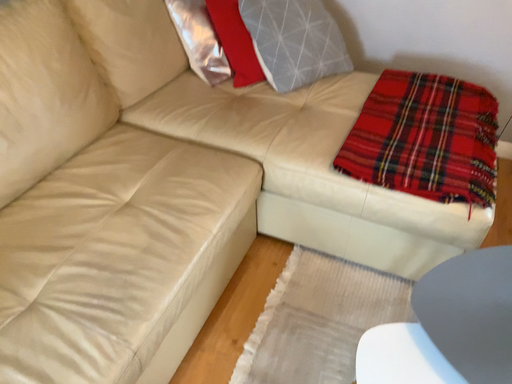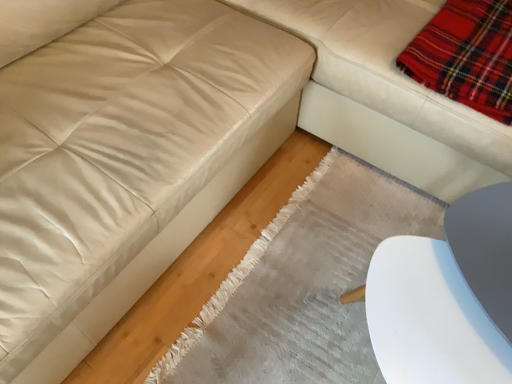
Question: Which way did the camera rotate in the video?

Choices:
 (A) rotated downward
 (B) rotated upward

Answer: (A)